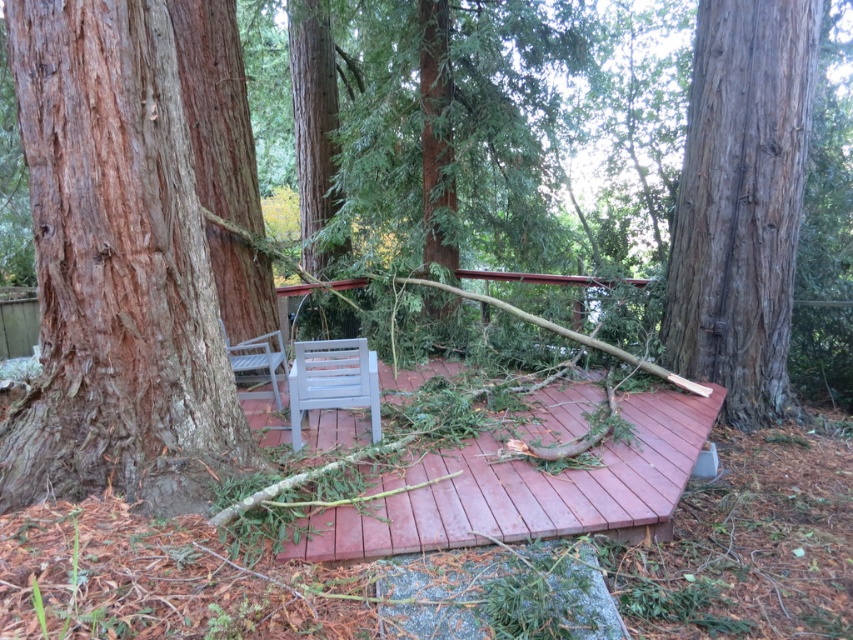
Question: Among these points, which one is nearest to the camera?

Choices:
 (A) (718, 211)
 (B) (271, 337)
 (C) (351, 365)

Answer: (C)

Question: Does smooth reddish-brown tree trunk at center-left appear under white plastic chair at center?

Choices:
 (A) no
 (B) yes

Answer: (A)

Question: Does smooth brown tree trunk at right lie in front of brown wood deck at center?

Choices:
 (A) yes
 (B) no

Answer: (B)

Question: Which point is farther to the camera?

Choices:
 (A) (280, 403)
 (B) (338, 532)

Answer: (A)

Question: Does smooth reddish-brown tree trunk at center-left appear on the right side of white plastic chair at center?

Choices:
 (A) no
 (B) yes

Answer: (A)

Question: Which point is farther to the camera?

Choices:
 (A) smooth brown tree trunk at right
 (B) white plastic chair at center

Answer: (A)